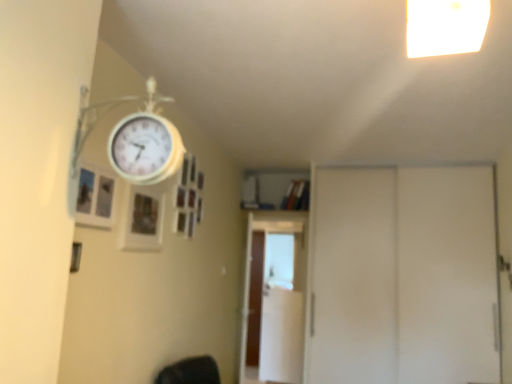
Find the location of a particular element. The image size is (512, 384). white glossy screen door at center, which appears as the second screen door when viewed from the back is located at coordinates (275, 298).

How much space does white glossy screen door at center, which appears as the second screen door when viewed from the back, occupy horizontally?

white glossy screen door at center, which appears as the second screen door when viewed from the back, is 2.01 inches wide.

Measure the distance between point (127, 213) and camera.

Point (127, 213) and camera are 6.75 feet apart.

What do you see at coordinates (404, 276) in the screenshot?
I see `white matte screen door at right, positioned as the first screen door in front-to-back order` at bounding box center [404, 276].

You are a GUI agent. You are given a task and a screenshot of the screen. Output one action in this format:
    pyautogui.click(x=<x>, y=<y>)
    Task: Click on the white glossy screen door at center, which appears as the second screen door when viewed from the back
    The height and width of the screenshot is (384, 512).
    Given the screenshot: What is the action you would take?
    pyautogui.click(x=275, y=298)

From a real-world perspective, is wooden picture frame at upper center, placed as the 2th picture frame when sorted from left to right, physically located above or below white glossy screen door at center, which appears as the second screen door when viewed from the back?

In terms of real-world spatial position, wooden picture frame at upper center, placed as the 2th picture frame when sorted from left to right, is above white glossy screen door at center, which appears as the second screen door when viewed from the back.

Does wooden picture frame at upper center, which is the first picture frame from right to left, turn towards white glossy screen door at center, the 2th screen door from the right?

No, wooden picture frame at upper center, which is the first picture frame from right to left, is not facing towards white glossy screen door at center, the 2th screen door from the right.

Can you confirm if wooden picture frame at upper center, marked as the 2th picture frame in a front-to-back arrangement, is positioned to the right of white glossy screen door at center, which appears as the second screen door when viewed from the back?

No.

Is wooden picture frame at upper center, which is the first picture frame from right to left, far from white glossy screen door at center, which appears as the second screen door when viewed from the back?

Yes, wooden picture frame at upper center, which is the first picture frame from right to left, and white glossy screen door at center, which appears as the second screen door when viewed from the back, are located far from each other.

Is wooden picture frame at upper left, placed as the second picture frame when sorted from back to front, outside of white plastic light fixture at upper right?

That's correct, wooden picture frame at upper left, placed as the second picture frame when sorted from back to front, is outside of white plastic light fixture at upper right.

Considering the relative positions of wooden picture frame at upper left, marked as the first picture frame in a left-to-right arrangement, and white plastic light fixture at upper right in the image provided, is wooden picture frame at upper left, marked as the first picture frame in a left-to-right arrangement, in front of white plastic light fixture at upper right?

No, wooden picture frame at upper left, marked as the first picture frame in a left-to-right arrangement, is further to the viewer.

Is wooden picture frame at upper left, placed as the second picture frame when sorted from back to front, oriented away from white plastic light fixture at upper right?

That's not correct — wooden picture frame at upper left, placed as the second picture frame when sorted from back to front, is not looking away from white plastic light fixture at upper right.

From a real-world perspective, is wooden picture frame at upper left, placed as the second picture frame when sorted from back to front, positioned above or below white plastic light fixture at upper right?

Clearly, from a real-world perspective, wooden picture frame at upper left, placed as the second picture frame when sorted from back to front, is below white plastic light fixture at upper right.

Is wooden picture frame at upper left, marked as the first picture frame in a left-to-right arrangement, positioned far away from white glossy screen door at center, marked as the second screen door in a left-to-right arrangement?

Yes, wooden picture frame at upper left, marked as the first picture frame in a left-to-right arrangement, and white glossy screen door at center, marked as the second screen door in a left-to-right arrangement, are quite far apart.

Could you tell me if wooden picture frame at upper left, placed as the second picture frame when sorted from back to front, is turned towards white glossy screen door at center, marked as the second screen door in a left-to-right arrangement?

No, wooden picture frame at upper left, placed as the second picture frame when sorted from back to front, is not oriented towards white glossy screen door at center, marked as the second screen door in a left-to-right arrangement.

Is wooden picture frame at upper left, placed as the second picture frame when sorted from back to front, smaller than white glossy screen door at center, the 2th screen door from the right?

Yes.

Considering the relative sizes of wooden picture frame at upper left, arranged as the first picture frame when viewed from the front, and white glossy screen door at center, the 2th screen door from the right, in the image provided, is wooden picture frame at upper left, arranged as the first picture frame when viewed from the front, taller than white glossy screen door at center, the 2th screen door from the right,?

In fact, wooden picture frame at upper left, arranged as the first picture frame when viewed from the front, may be shorter than white glossy screen door at center, the 2th screen door from the right.

From the image's perspective, is white matte screen door at right, the 1th screen door positioned from the right, positioned above or below wooden picture frame at upper center, marked as the 2th picture frame in a front-to-back arrangement?

white matte screen door at right, the 1th screen door positioned from the right, is situated lower than wooden picture frame at upper center, marked as the 2th picture frame in a front-to-back arrangement, in the image.

Is wooden picture frame at upper center, marked as the 2th picture frame in a front-to-back arrangement, located within white matte screen door at right, the 1th screen door positioned from the right?

No, wooden picture frame at upper center, marked as the 2th picture frame in a front-to-back arrangement, is not inside white matte screen door at right, the 1th screen door positioned from the right.

Considering the sizes of objects white matte screen door at right, the 1th screen door positioned from the right, and wooden picture frame at upper center, the first picture frame when ordered from back to front, in the image provided, who is wider, white matte screen door at right, the 1th screen door positioned from the right, or wooden picture frame at upper center, the first picture frame when ordered from back to front,?

With larger width is white matte screen door at right, the 1th screen door positioned from the right.

Is white matte screen door at right, positioned as the first screen door in front-to-back order, not near wooden picture frame at upper center, marked as the 2th picture frame in a front-to-back arrangement?

Yes, white matte screen door at right, positioned as the first screen door in front-to-back order, is far from wooden picture frame at upper center, marked as the 2th picture frame in a front-to-back arrangement.

Consider the image. Who is more distant, brown wooden screen door at center, the third screen door when ordered from right to left, or white matte screen door at right, which ranks as the third screen door in left-to-right order?

brown wooden screen door at center, the third screen door when ordered from right to left, is further away from the camera.

From a real-world perspective, is brown wooden screen door at center, the 3th screen door when ordered from front to back, physically above white matte screen door at right, the 1th screen door positioned from the right?

No.

What's the angular difference between brown wooden screen door at center, the third screen door when ordered from right to left, and white matte screen door at right, the 1th screen door positioned from the right,'s facing directions?

3.58 degrees separate the facing orientations of brown wooden screen door at center, the third screen door when ordered from right to left, and white matte screen door at right, the 1th screen door positioned from the right.

Is brown wooden screen door at center, the 3th screen door when ordered from front to back, next to white matte screen door at right, the 3th screen door viewed from the back, and touching it?

No, brown wooden screen door at center, the 3th screen door when ordered from front to back, is not in contact with white matte screen door at right, the 3th screen door viewed from the back.

Considering the sizes of objects wooden picture frame at upper center, placed as the 2th picture frame when sorted from left to right, and white plastic light fixture at upper right in the image provided, who is smaller, wooden picture frame at upper center, placed as the 2th picture frame when sorted from left to right, or white plastic light fixture at upper right?

With smaller size is wooden picture frame at upper center, placed as the 2th picture frame when sorted from left to right.

From the image's perspective, is wooden picture frame at upper center, marked as the 2th picture frame in a front-to-back arrangement, over white plastic light fixture at upper right?

No, from the image's perspective, wooden picture frame at upper center, marked as the 2th picture frame in a front-to-back arrangement, is not on top of white plastic light fixture at upper right.

Between wooden picture frame at upper center, marked as the 2th picture frame in a front-to-back arrangement, and white plastic light fixture at upper right, which one has smaller width?

With smaller width is wooden picture frame at upper center, marked as the 2th picture frame in a front-to-back arrangement.

Is wooden picture frame at upper center, placed as the 2th picture frame when sorted from left to right, oriented towards white plastic light fixture at upper right?

No.

In the scene shown: Does white plastic light fixture at upper right appear on the right side of wooden picture frame at upper center, marked as the 2th picture frame in a front-to-back arrangement?

Yes.

Can you tell me how much white plastic light fixture at upper right and wooden picture frame at upper center, the first picture frame when ordered from back to front, differ in facing direction?

The angular difference between white plastic light fixture at upper right and wooden picture frame at upper center, the first picture frame when ordered from back to front, is 81.7 degrees.

Is white plastic light fixture at upper right oriented towards wooden picture frame at upper center, placed as the 2th picture frame when sorted from left to right?

No, white plastic light fixture at upper right does not turn towards wooden picture frame at upper center, placed as the 2th picture frame when sorted from left to right.

Consider the image. In terms of height, does white plastic light fixture at upper right look taller or shorter compared to wooden picture frame at upper center, the first picture frame when ordered from back to front?

Considering their sizes, white plastic light fixture at upper right has less height than wooden picture frame at upper center, the first picture frame when ordered from back to front.

There is a white glossy screen door at center, the 2th screen door from the right. Identify the location of the 1st picture frame above it (from a real-world perspective). Image resolution: width=512 pixels, height=384 pixels. (142, 219).

You are a GUI agent. You are given a task and a screenshot of the screen. Output one action in this format:
    pyautogui.click(x=<x>, y=<y>)
    Task: Click on the light fixture in front of the wooden picture frame at upper left, the second picture frame positioned from the right
    
    Given the screenshot: What is the action you would take?
    (x=445, y=26)

When comparing their distances from white matte screen door at right, which ranks as the third screen door in left-to-right order, does brown wooden screen door at center, the third screen door when ordered from right to left, or white plastic light fixture at upper right seem further?

white plastic light fixture at upper right lies further to white matte screen door at right, which ranks as the third screen door in left-to-right order, than the other object.

Which object lies nearer to the anchor point wooden picture frame at upper center, which is the first picture frame from right to left, white glossy screen door at center, which appears as the second screen door when viewed from the back, or wooden picture frame at upper left, placed as the second picture frame when sorted from back to front?

wooden picture frame at upper left, placed as the second picture frame when sorted from back to front, lies closer to wooden picture frame at upper center, which is the first picture frame from right to left, than the other object.

In the scene shown: Estimate the real-world distances between objects in this image. Which object is further from white plastic light fixture at upper right, wooden picture frame at upper center, the first picture frame when ordered from back to front, or white glossy screen door at center, marked as the second screen door in a left-to-right arrangement?

The object further to white plastic light fixture at upper right is white glossy screen door at center, marked as the second screen door in a left-to-right arrangement.

When comparing their distances from white plastic light fixture at upper right, does white matte screen door at right, the 1th screen door positioned from the right, or brown wooden screen door at center, which appears as the first screen door when viewed from the left, seem further?

brown wooden screen door at center, which appears as the first screen door when viewed from the left, lies further to white plastic light fixture at upper right than the other object.

Which object lies further to the anchor point white matte screen door at right, the 1th screen door positioned from the right, wooden picture frame at upper center, the first picture frame when ordered from back to front, or white plastic light fixture at upper right?

Based on the image, white plastic light fixture at upper right appears to be further to white matte screen door at right, the 1th screen door positioned from the right.

From the image, which object appears to be farther from wooden picture frame at upper center, placed as the 2th picture frame when sorted from left to right, white matte screen door at right, positioned as the first screen door in front-to-back order, or white plastic light fixture at upper right?

Among the two, white matte screen door at right, positioned as the first screen door in front-to-back order, is located further to wooden picture frame at upper center, placed as the 2th picture frame when sorted from left to right.

Considering their positions, is white matte screen door at right, positioned as the first screen door in front-to-back order, positioned closer to wooden picture frame at upper left, arranged as the first picture frame when viewed from the front, than white glossy screen door at center, the 2th screen door from the right?

Among the two, white matte screen door at right, positioned as the first screen door in front-to-back order, is located nearer to wooden picture frame at upper left, arranged as the first picture frame when viewed from the front.

When comparing their distances from brown wooden screen door at center, acting as the first screen door starting from the back, does white matte screen door at right, the 3th screen door viewed from the back, or wooden picture frame at upper center, placed as the 2th picture frame when sorted from left to right, seem further?

wooden picture frame at upper center, placed as the 2th picture frame when sorted from left to right, is further to brown wooden screen door at center, acting as the first screen door starting from the back.

Locate an element on the screen. screen door between wooden picture frame at upper center, the first picture frame when ordered from back to front, and white glossy screen door at center, which ranks as the 2th screen door in front-to-back order, in the front-back direction is located at coordinates (404, 276).

At what (x,y) coordinates should I click in order to perform the action: click on screen door between white matte screen door at right, which ranks as the third screen door in left-to-right order, and brown wooden screen door at center, the 3th screen door when ordered from front to back, along the z-axis. Please return your answer as a coordinate pair (x, y). Image resolution: width=512 pixels, height=384 pixels. Looking at the image, I should click on (275, 298).

In order to click on screen door positioned between wooden picture frame at upper left, the second picture frame positioned from the right, and white glossy screen door at center, which ranks as the 2th screen door in front-to-back order, from near to far in this screenshot , I will do `click(404, 276)`.

I want to click on screen door between white plastic light fixture at upper right and white glossy screen door at center, marked as the second screen door in a left-to-right arrangement, in the front-back direction, so click(x=404, y=276).